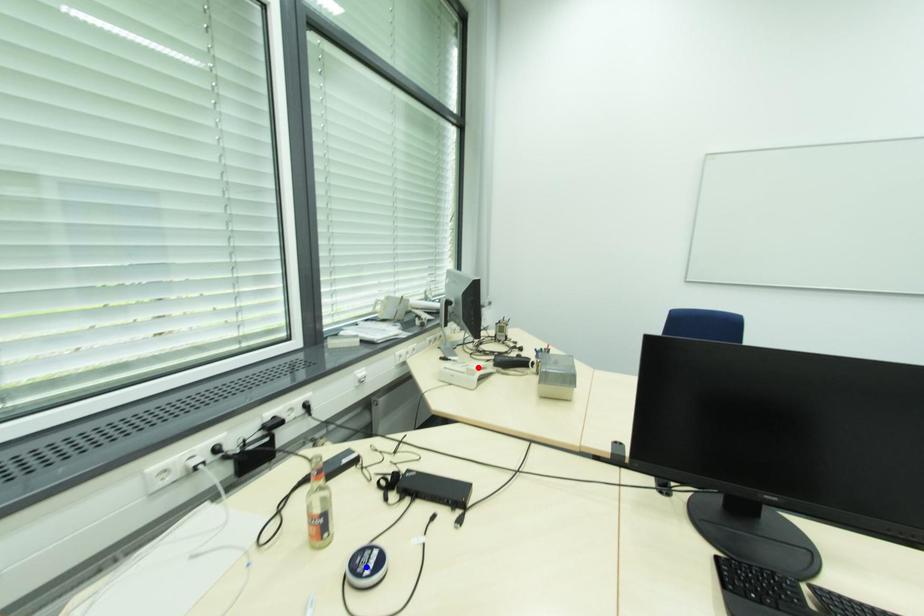
Question: Two points are marked on the image. Which point is closer to the camera?

Choices:
 (A) Blue point is closer.
 (B) Red point is closer.

Answer: (A)